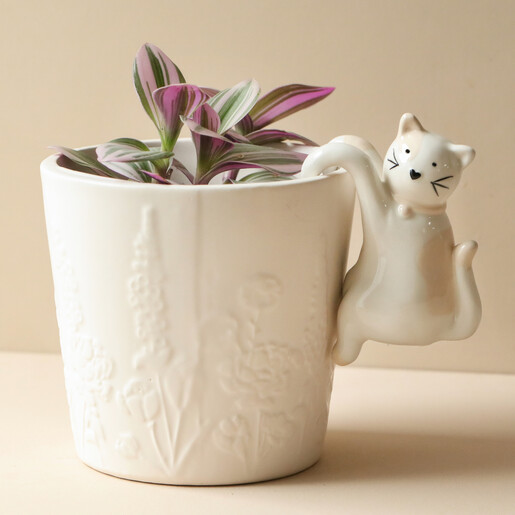
Locate an element on the screen. The width and height of the screenshot is (515, 515). table is located at coordinates (365, 495).